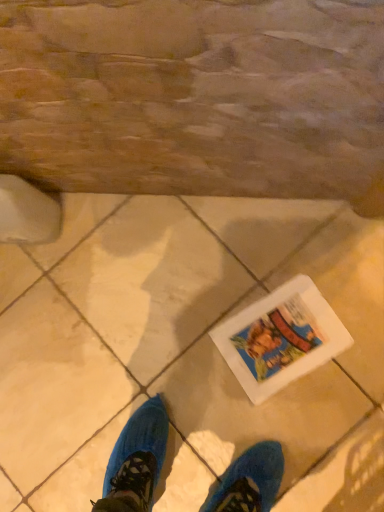
Identify the location of free space in front of white matte comic book at lower center. This screenshot has height=512, width=384. (328, 413).